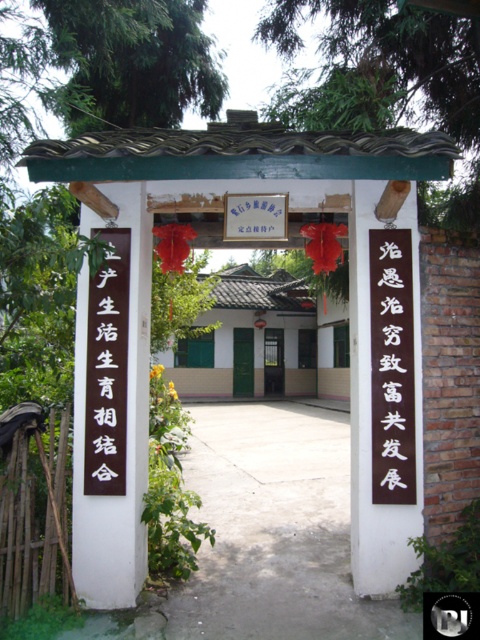
Question: In this image, where is green leafy tree at upper center located relative to green matte door at center?

Choices:
 (A) below
 (B) above

Answer: (B)

Question: Which of the following is the farthest from the observer?

Choices:
 (A) black wood sign at center
 (B) green leafy tree at upper left
 (C) green leafy tree at upper center
 (D) brown wooden sign at center-right

Answer: (B)

Question: Does green leafy tree at upper center have a greater width compared to metallic door at center?

Choices:
 (A) no
 (B) yes

Answer: (B)

Question: Estimate the real-world distances between objects in this image. Which object is closer to the black wood sign at center?

Choices:
 (A) metallic door at center
 (B) green leafy tree at upper left
 (C) green matte door at center
 (D) brown wooden sign at center-right

Answer: (D)

Question: Which object is the farthest from the metallic door at center?

Choices:
 (A) brown wooden sign at center-right
 (B) green leafy tree at upper left
 (C) green leafy tree at upper center

Answer: (A)

Question: Can you confirm if green leafy tree at upper left is wider than black wood sign at center?

Choices:
 (A) yes
 (B) no

Answer: (A)